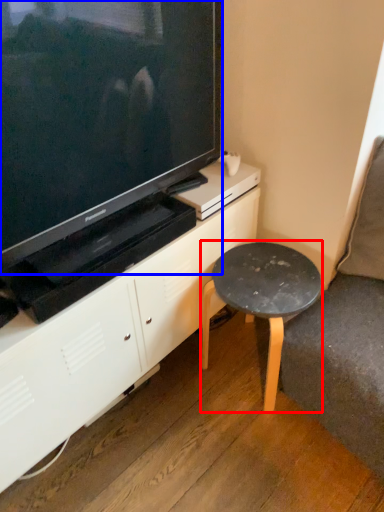
Question: Which point is closer to the camera, stool (highlighted by a red box) or television (highlighted by a blue box)?

Choices:
 (A) stool
 (B) television

Answer: (B)